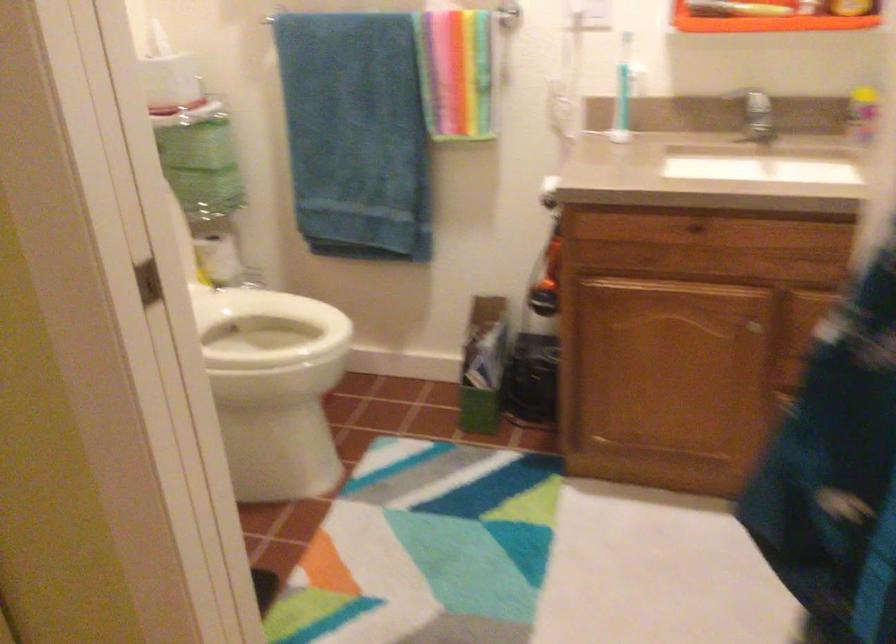
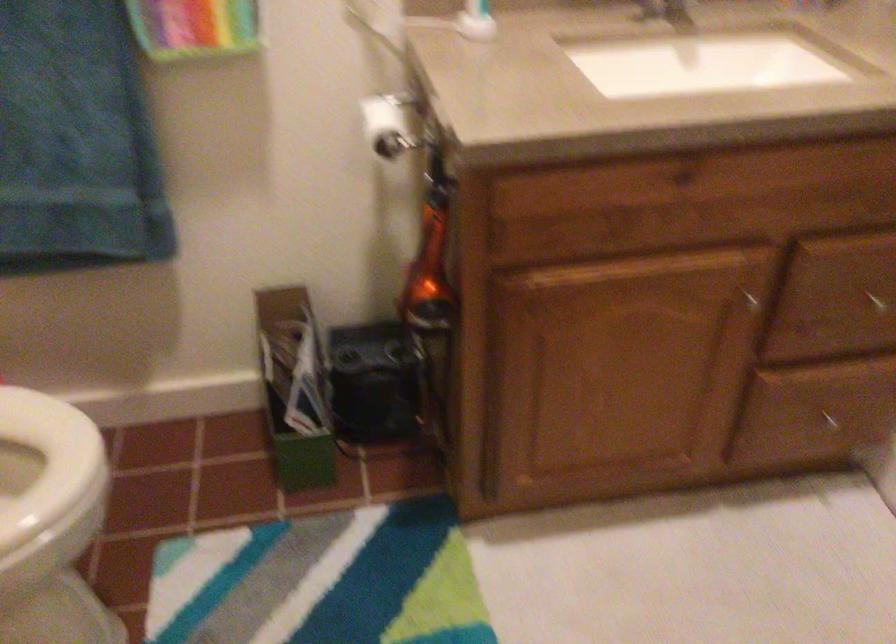
Locate, in the second image, the point that corresponds to the point at 319,336 in the first image.

(47, 466)